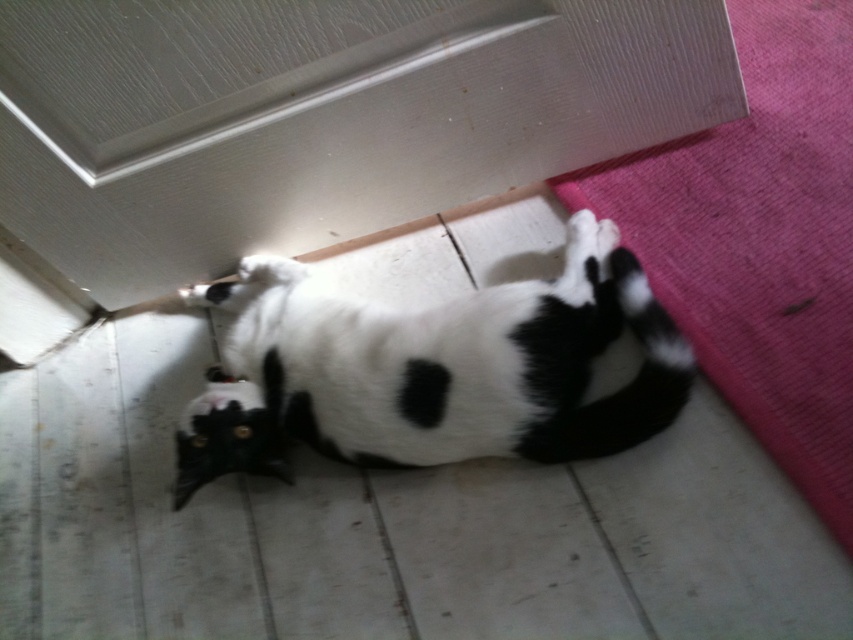
Does black and white fur cat at center have a greater width compared to pink fabric mat at lower right?

Correct, the width of black and white fur cat at center exceeds that of pink fabric mat at lower right.

Is black and white fur cat at center further to camera compared to pink fabric mat at lower right?

Yes, black and white fur cat at center is further from the viewer.

Which is behind, point (434, 445) or point (579, 202)?

Point (579, 202)

The image size is (853, 640). I want to click on black and white fur cat at center, so click(x=431, y=369).